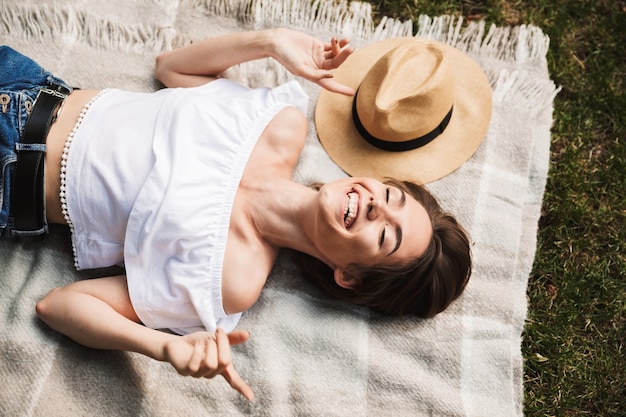
Locate an element on the screen. blanket is located at coordinates (486, 180).